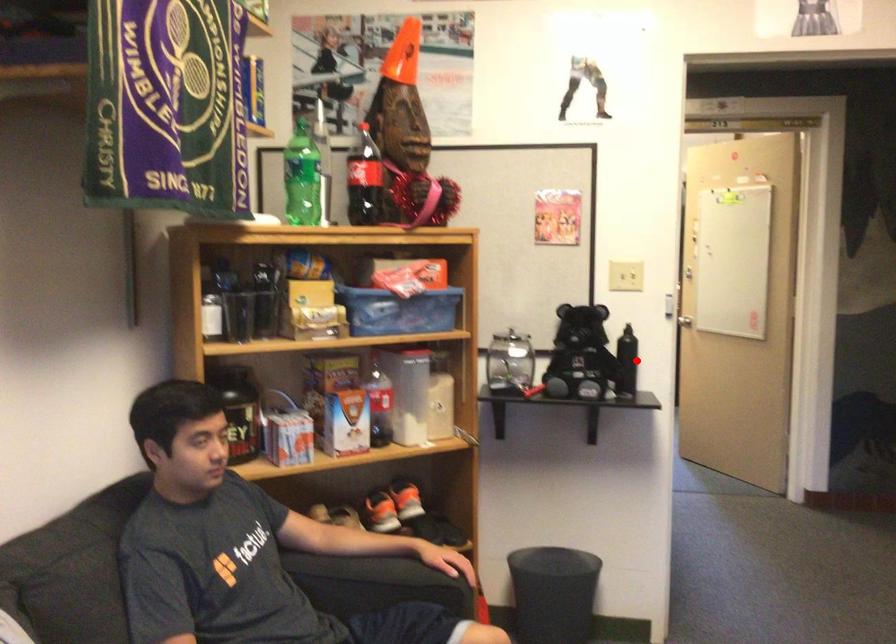
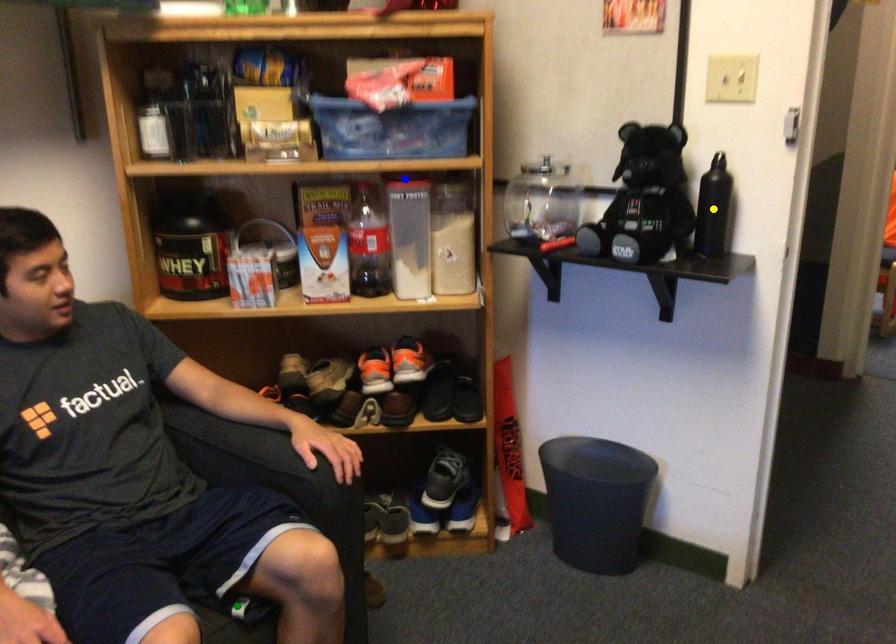
Question: I am providing you with two images of the same scene from different viewpoints. A red point is marked on the first image. You are given multiple points on the second image. Which spot in image 2 lines up with the point in image 1?

Choices:
 (A) yellow point
 (B) blue point
 (C) green point

Answer: (A)